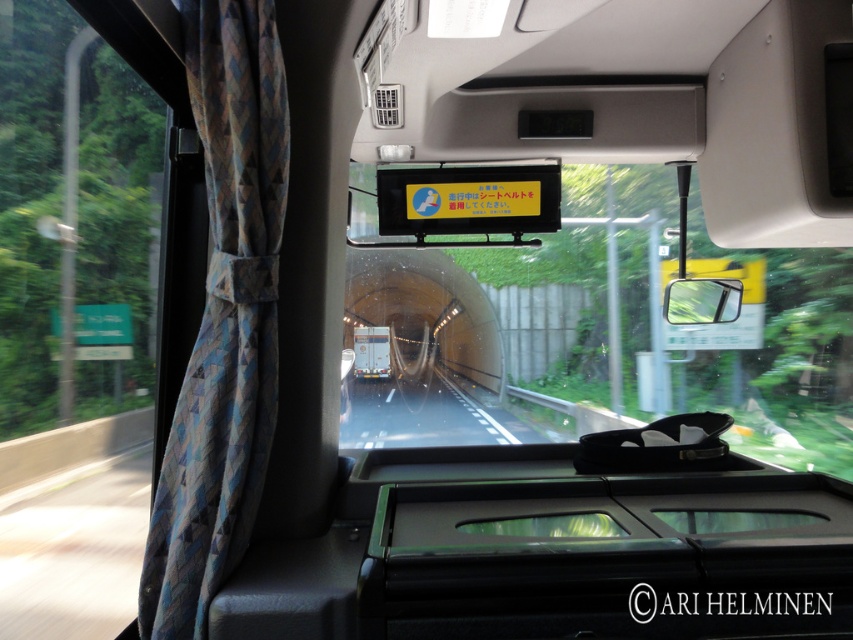
Is transparent glass windshield at center bigger than metallic silver phone at center?

Correct, transparent glass windshield at center is larger in size than metallic silver phone at center.

The image size is (853, 640). Describe the element at coordinates (599, 332) in the screenshot. I see `transparent glass windshield at center` at that location.

This screenshot has width=853, height=640. Find the location of `transparent glass windshield at center`. transparent glass windshield at center is located at coordinates pyautogui.click(x=599, y=332).

Is transparent glass window at left to the left of blue fabric curtain at left from the viewer's perspective?

Yes, transparent glass window at left is to the left of blue fabric curtain at left.

Identify the location of transparent glass window at left. Image resolution: width=853 pixels, height=640 pixels. (115, 234).

Who is higher up, transparent glass window at left or metallic silver phone at center?

Positioned higher is metallic silver phone at center.

Does point (39, 385) come closer to viewer compared to point (363, 356)?

Yes, point (39, 385) is in front of point (363, 356).

Is point (50, 150) closer to viewer compared to point (358, 360)?

Yes, it is.

This screenshot has height=640, width=853. Identify the location of transparent glass window at left. (115, 234).